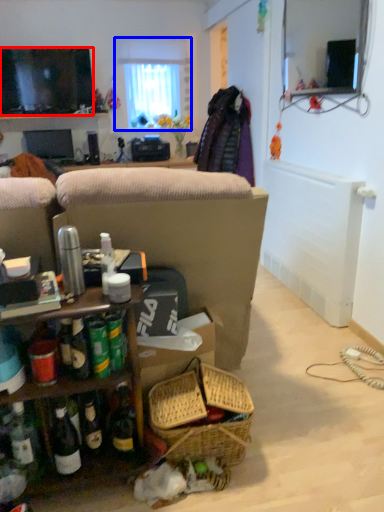
Question: Which object appears closest to the camera in this image, television (highlighted by a red box) or window (highlighted by a blue box)?

Choices:
 (A) television
 (B) window

Answer: (A)